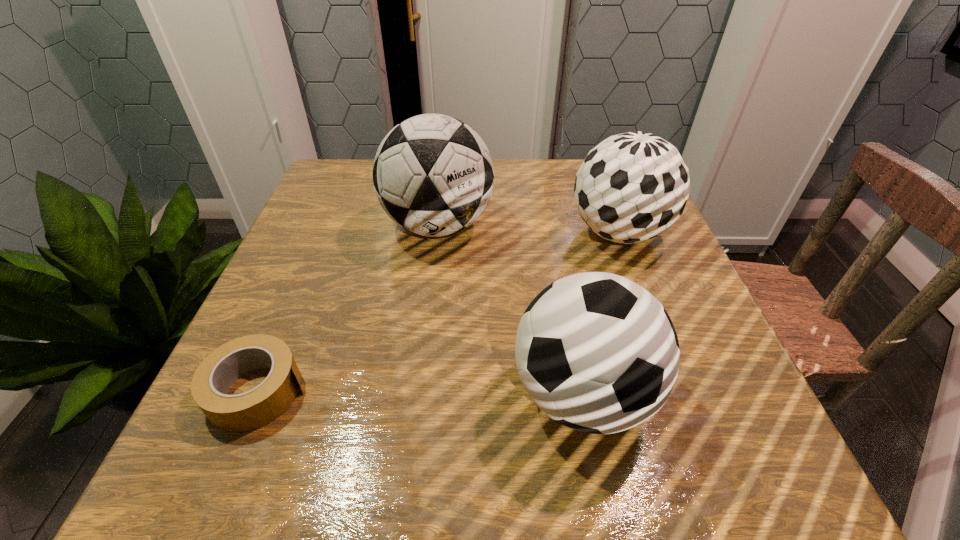
Where is `vacant area between the nearest soccer ball and the leftmost soccer ball`? The width and height of the screenshot is (960, 540). vacant area between the nearest soccer ball and the leftmost soccer ball is located at coordinates (510, 310).

The image size is (960, 540). Identify the location of free area in between the third object from right to left and the nearest soccer ball. (510, 310).

Find the location of `unoccupied area between the duct tape and the nearest soccer ball`. unoccupied area between the duct tape and the nearest soccer ball is located at coordinates (420, 393).

The image size is (960, 540). I want to click on free area in between the shortest object and the leftmost soccer ball, so click(348, 308).

This screenshot has width=960, height=540. I want to click on free spot between the nearest soccer ball and the leftmost soccer ball, so click(510, 310).

The height and width of the screenshot is (540, 960). Find the location of `vacant space that's between the leftmost object and the nearest soccer ball`. vacant space that's between the leftmost object and the nearest soccer ball is located at coordinates (420, 393).

I want to click on vacant area that lies between the nearest soccer ball and the leftmost soccer ball, so click(510, 310).

Locate which object ranks second in proximity to the leftmost soccer ball. Please provide its 2D coordinates. Your answer should be formatted as a tuple, i.e. [(x, y)], where the tuple contains the x and y coordinates of a point satisfying the conditions above.

[(596, 352)]

The width and height of the screenshot is (960, 540). I want to click on object that is the closest to the nearest soccer ball, so click(x=632, y=187).

Locate an element on the screen. The height and width of the screenshot is (540, 960). the closest soccer ball to the nearest soccer ball is located at coordinates (632, 187).